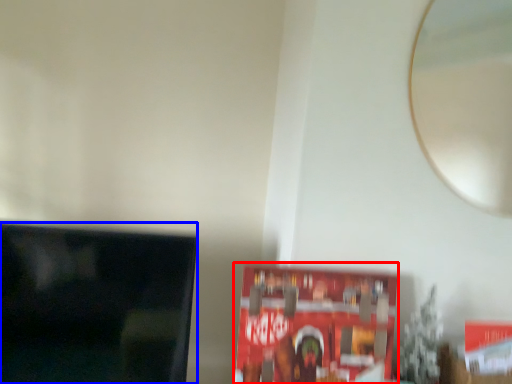
Question: Which object is further to the camera taking this photo, paperback book (highlighted by a red box) or television (highlighted by a blue box)?

Choices:
 (A) paperback book
 (B) television

Answer: (A)